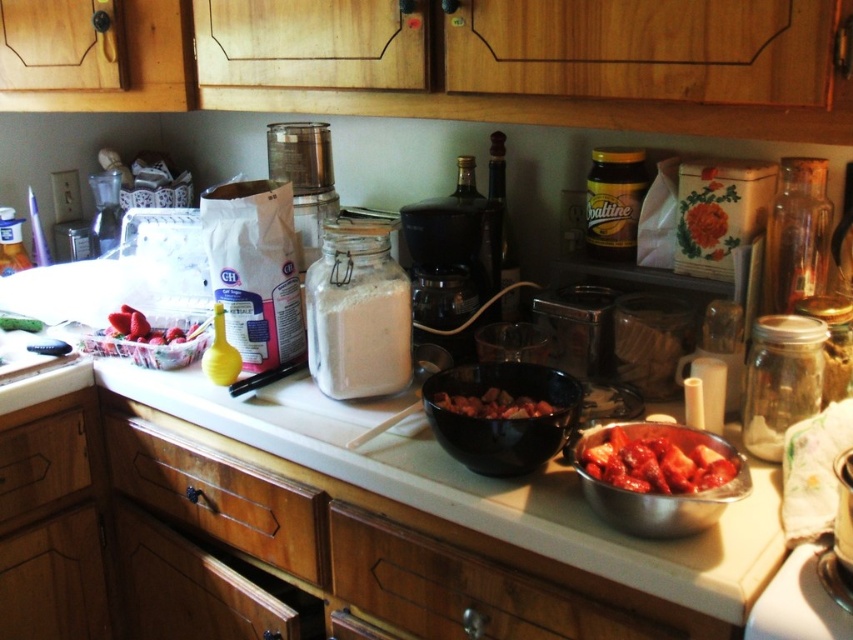
At what (x,y) coordinates should I click in order to perform the action: click on black matte bowl at center. Please return your answer as a coordinate pair (x, y). The image size is (853, 640). Looking at the image, I should click on (503, 419).

Can you confirm if black matte bowl at center is bigger than bright red tomato at right?

Indeed, black matte bowl at center has a larger size compared to bright red tomato at right.

Where is `black matte bowl at center`? black matte bowl at center is located at coordinates (503, 419).

Describe the element at coordinates (219, 497) in the screenshot. I see `wooden drawer at center` at that location.

Does wooden drawer at center appear under bright red tomato at right?

Yes.

Who is more forward, (184, 500) or (674, 492)?

Point (674, 492)

Locate an element on the screen. Image resolution: width=853 pixels, height=640 pixels. wooden drawer at center is located at coordinates (219, 497).

What do you see at coordinates (503, 419) in the screenshot?
I see `black matte bowl at center` at bounding box center [503, 419].

Who is more distant from viewer, (498, 467) or (445, 404)?

The point (445, 404) is more distant.

Where is `black matte bowl at center`? black matte bowl at center is located at coordinates (503, 419).